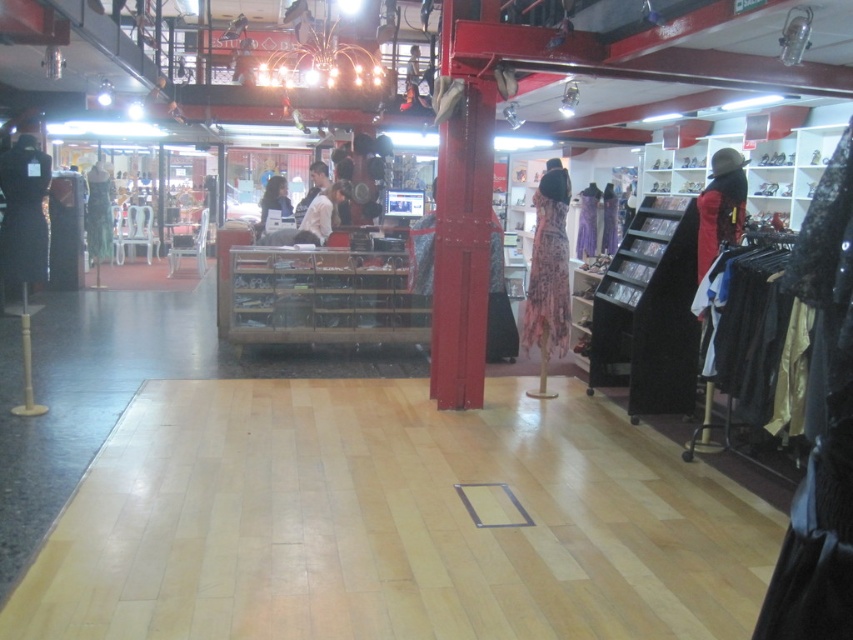
Is floral-patterned fabric dress at center to the left of black matte coat at left from the viewer's perspective?

In fact, floral-patterned fabric dress at center is to the right of black matte coat at left.

Which is in front, point (561, 232) or point (16, 196)?

Point (561, 232)

What are the coordinates of `floral-patterned fabric dress at center` in the screenshot? It's located at (548, 268).

Does black fabric dress at right have a lesser height compared to matte black dress at center?

Incorrect, black fabric dress at right's height does not fall short of matte black dress at center's.

Is black fabric dress at right positioned at the back of matte black dress at center?

No, black fabric dress at right is closer to the viewer.

At what (x,y) coordinates should I click in order to perform the action: click on black fabric dress at right. Please return your answer as a coordinate pair (x, y). This screenshot has height=640, width=853. Looking at the image, I should click on 744,326.

Can you confirm if black matte coat at left is wider than white matte shirt at center?

Indeed, black matte coat at left has a greater width compared to white matte shirt at center.

Is point (10, 243) farther from viewer compared to point (316, 205)?

No, it is not.

At what (x,y) coordinates should I click in order to perform the action: click on black matte coat at left. Please return your answer as a coordinate pair (x, y). This screenshot has width=853, height=640. Looking at the image, I should click on (22, 212).